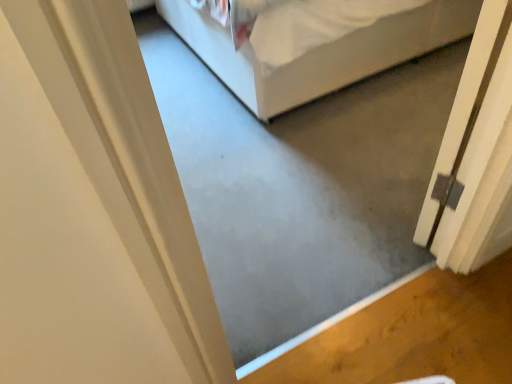
Question: Should I look upward or downward to see white matte door at right?

Choices:
 (A) up
 (B) down

Answer: (A)

Question: Does white matte door at right have a greater height compared to white fabric bed at center?

Choices:
 (A) no
 (B) yes

Answer: (B)

Question: Considering the relative positions of white matte door at right and white fabric bed at center in the image provided, is white matte door at right in front of white fabric bed at center?

Choices:
 (A) yes
 (B) no

Answer: (A)

Question: Is white matte door at right completely or partially outside of white fabric bed at center?

Choices:
 (A) no
 (B) yes

Answer: (B)

Question: Considering the relative sizes of white matte door at right and white fabric bed at center in the image provided, is white matte door at right thinner than white fabric bed at center?

Choices:
 (A) yes
 (B) no

Answer: (A)

Question: Can you confirm if white matte door at right is positioned to the left of white fabric bed at center?

Choices:
 (A) yes
 (B) no

Answer: (B)

Question: Is white matte door at right to the right of white fabric bed at center from the viewer's perspective?

Choices:
 (A) yes
 (B) no

Answer: (A)

Question: From a real-world perspective, does white fabric bed at center stand above white matte door at right?

Choices:
 (A) no
 (B) yes

Answer: (A)

Question: Does white fabric bed at center turn towards white matte door at right?

Choices:
 (A) yes
 (B) no

Answer: (B)

Question: From the image's perspective, is white fabric bed at center on top of white matte door at right?

Choices:
 (A) yes
 (B) no

Answer: (A)

Question: Can you confirm if white fabric bed at center is wider than white matte door at right?

Choices:
 (A) no
 (B) yes

Answer: (B)

Question: Is white fabric bed at center positioned in front of white matte door at right?

Choices:
 (A) yes
 (B) no

Answer: (B)

Question: Is white fabric bed at center smaller than white matte door at right?

Choices:
 (A) no
 (B) yes

Answer: (A)

Question: Considering the positions of white fabric bed at center and white matte door at right in the image, is white fabric bed at center wider or thinner than white matte door at right?

Choices:
 (A) wide
 (B) thin

Answer: (A)